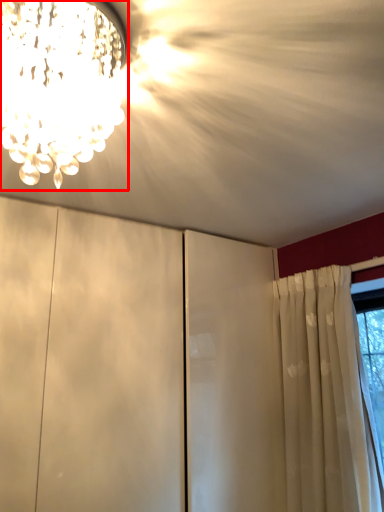
Question: From the image, what is the correct spatial relationship of lamp (annotated by the red box) in relation to cloud?

Choices:
 (A) right
 (B) left

Answer: (B)